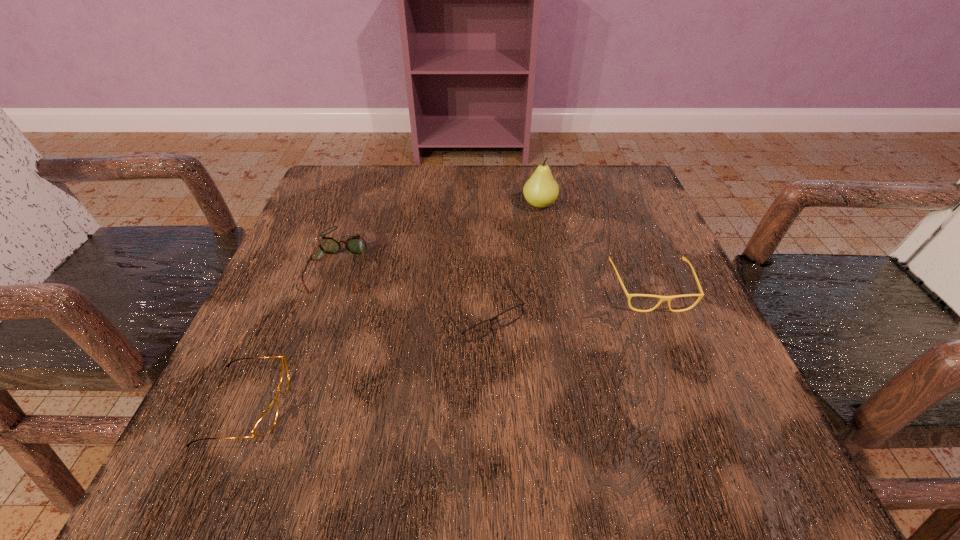
Identify the location of the farthest object. (x=541, y=190).

At what (x,y) coordinates should I click in order to perform the action: click on the tallest object. Please return your answer as a coordinate pair (x, y). The image size is (960, 540). Looking at the image, I should click on (541, 190).

Where is `the rightmost spectacles`? the rightmost spectacles is located at coordinates (662, 298).

The height and width of the screenshot is (540, 960). Find the location of `the third spectacles from left to right`. the third spectacles from left to right is located at coordinates (x=510, y=315).

Find the location of a particular element. The height and width of the screenshot is (540, 960). the nearest spectacles is located at coordinates (266, 422).

Identify the location of free space located 0.120m on the front of the tallest object. Image resolution: width=960 pixels, height=540 pixels. (547, 251).

Locate an element on the screen. Image resolution: width=960 pixels, height=540 pixels. free space located 0.170m in front of the lenses of the rightmost spectacles is located at coordinates (697, 403).

Find the location of a particular element. free space located 0.070m with the lenses facing outward on the third object from right to left is located at coordinates (485, 382).

Find the location of `free region located 0.140m on the front-facing side of the nearest object`. free region located 0.140m on the front-facing side of the nearest object is located at coordinates (x=385, y=406).

Where is `object that is at the far edge`? The height and width of the screenshot is (540, 960). object that is at the far edge is located at coordinates coord(541,190).